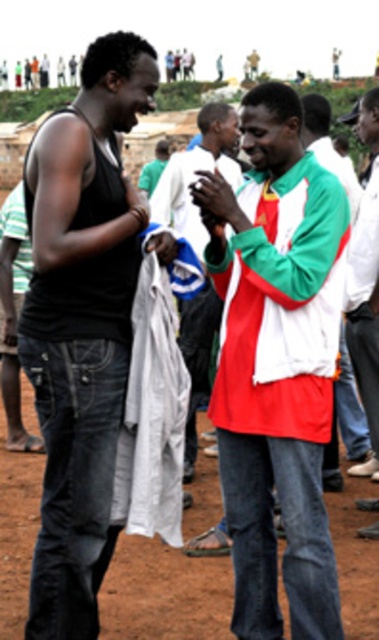
Question: Where is red and white jacket at center located in relation to white cotton shirt at center in the image?

Choices:
 (A) left
 (B) right

Answer: (A)

Question: Can you confirm if red and white jacket at center is bigger than white cotton shirt at center?

Choices:
 (A) yes
 (B) no

Answer: (A)

Question: Which of the following is the farthest from the observer?

Choices:
 (A) (9, 577)
 (B) (227, 147)

Answer: (B)

Question: Is white fabric at center smaller than white cotton shirt at center?

Choices:
 (A) yes
 (B) no

Answer: (B)

Question: Among these points, which one is farthest from the camera?

Choices:
 (A) pyautogui.click(x=32, y=477)
 (B) pyautogui.click(x=377, y=416)

Answer: (A)

Question: Based on their relative distances, which object is farther from the white fabric at center?

Choices:
 (A) black denim jeans at left
 (B) dirt field at lower center

Answer: (B)